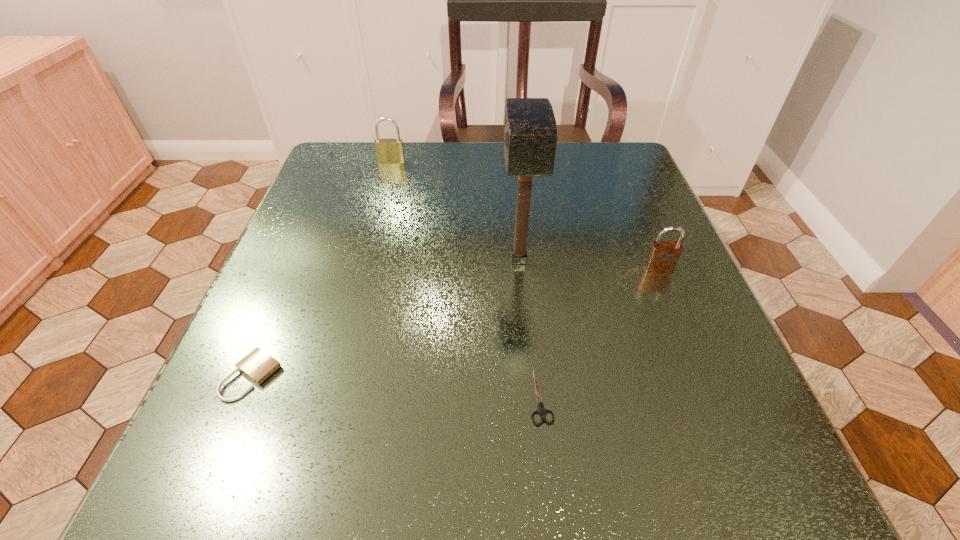
Where is `vacant space at the far left corner`? The width and height of the screenshot is (960, 540). vacant space at the far left corner is located at coordinates pyautogui.click(x=365, y=194).

The width and height of the screenshot is (960, 540). What are the coordinates of `free region at the far right corner of the desktop` in the screenshot? It's located at (636, 187).

You are a GUI agent. You are given a task and a screenshot of the screen. Output one action in this format:
    pyautogui.click(x=<x>, y=<y>)
    Task: Click on the vacant space that is in between the shortest padlock and the shortest object
    This screenshot has height=540, width=960.
    Given the screenshot: What is the action you would take?
    pyautogui.click(x=396, y=386)

The width and height of the screenshot is (960, 540). I want to click on free space between the shears and the mallet, so click(530, 328).

The width and height of the screenshot is (960, 540). I want to click on free space between the fourth object from right to left and the leftmost padlock, so click(322, 268).

The height and width of the screenshot is (540, 960). I want to click on free space between the shortest object and the tallest object, so click(x=530, y=328).

Locate an element on the screen. vacant area between the third tallest object and the shears is located at coordinates (600, 332).

Locate an element on the screen. This screenshot has height=540, width=960. free space between the shears and the second padlock from left to right is located at coordinates (466, 279).

I want to click on empty space between the shortest object and the tallest object, so click(530, 328).

You are a GUI agent. You are given a task and a screenshot of the screen. Output one action in this format:
    pyautogui.click(x=<x>, y=<y>)
    Task: Click on the free space between the shortest padlock and the rightmost object
    Image resolution: width=960 pixels, height=540 pixels.
    Given the screenshot: What is the action you would take?
    pyautogui.click(x=456, y=322)